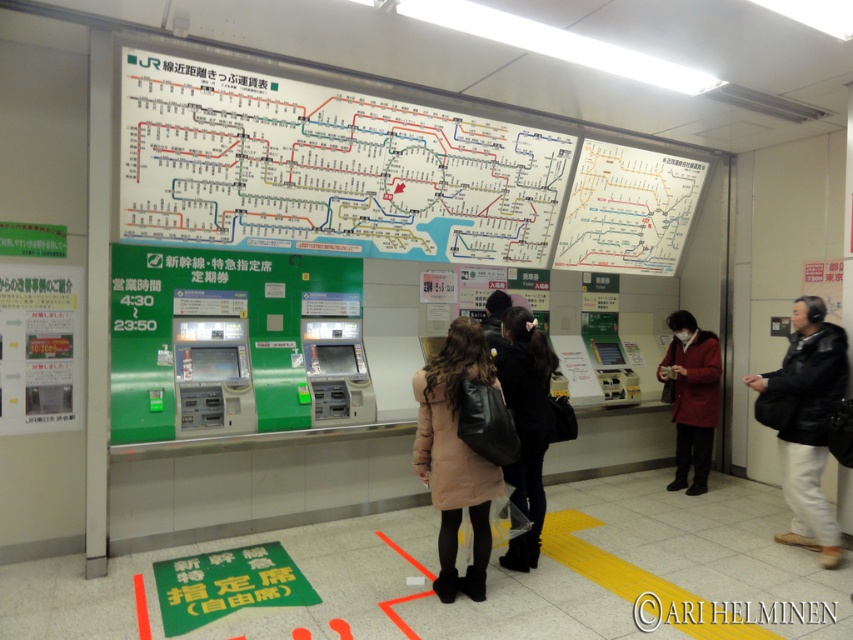
Question: Can you confirm if black leather jacket at right is positioned to the left of black leather jacket at center?

Choices:
 (A) yes
 (B) no

Answer: (B)

Question: Which point is farther to the camera?

Choices:
 (A) white paper map at upper right
 (B) white paper map at upper center
 (C) green paper poster at left

Answer: (A)

Question: Which is farther from the beige wool coat at center?

Choices:
 (A) black leather jacket at right
 (B) white paper map at upper center

Answer: (B)

Question: Is white paper map at upper center thinner than green paper poster at left?

Choices:
 (A) no
 (B) yes

Answer: (A)

Question: Which point appears farthest from the camera in this image?

Choices:
 (A) (708, 348)
 (B) (55, 296)
 (C) (695, 161)
 (D) (589, 234)

Answer: (C)

Question: Where is black leather jacket at right located in relation to black leather jacket at center in the image?

Choices:
 (A) above
 (B) below

Answer: (A)